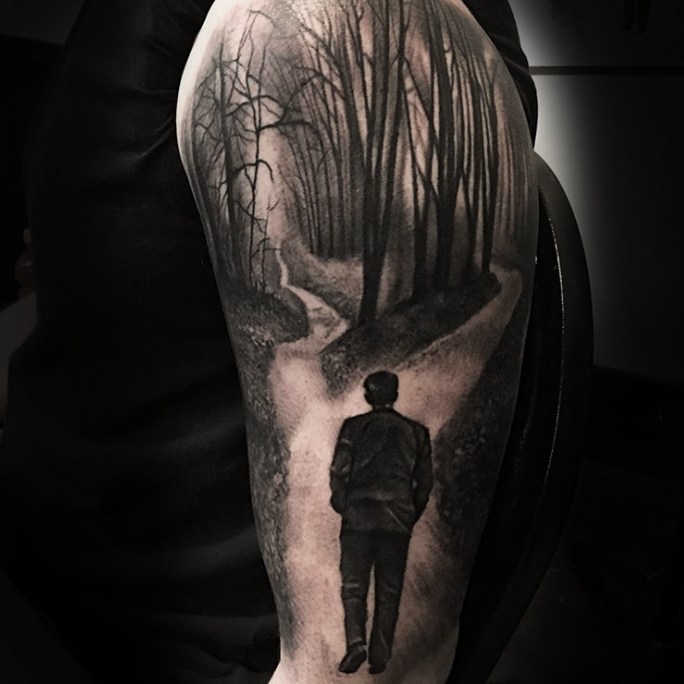
Where is `wall`? wall is located at coordinates (598, 103).